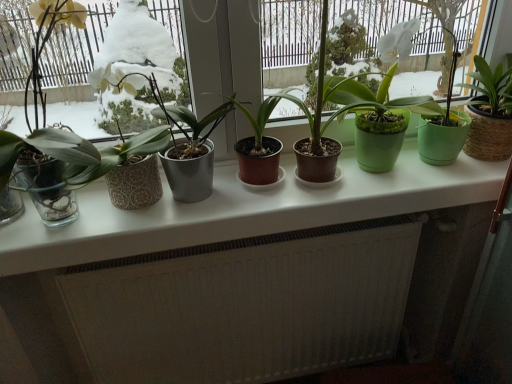
Where is `vacant space in front of green matte pot at center, which appears as the 4th houseplant when viewed from the left`? This screenshot has height=384, width=512. vacant space in front of green matte pot at center, which appears as the 4th houseplant when viewed from the left is located at coordinates (372, 196).